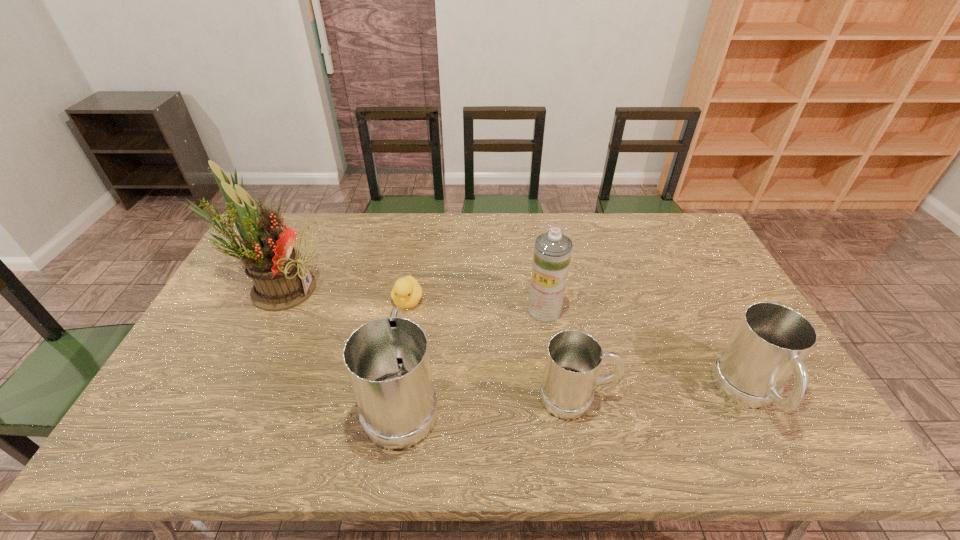
Locate an element on the screen. Image resolution: width=960 pixels, height=540 pixels. vacant place for an extra mug on the left is located at coordinates (226, 403).